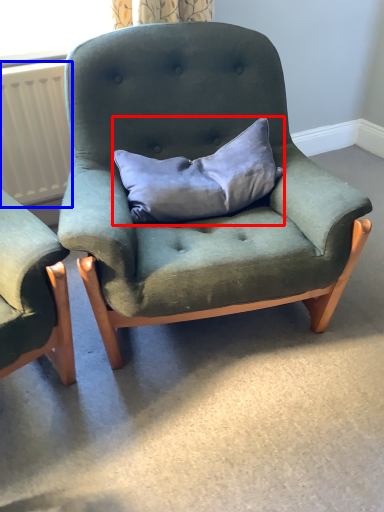
Question: Which of the following is the farthest to the observer, pillow (highlighted by a red box) or radiator (highlighted by a blue box)?

Choices:
 (A) pillow
 (B) radiator

Answer: (B)